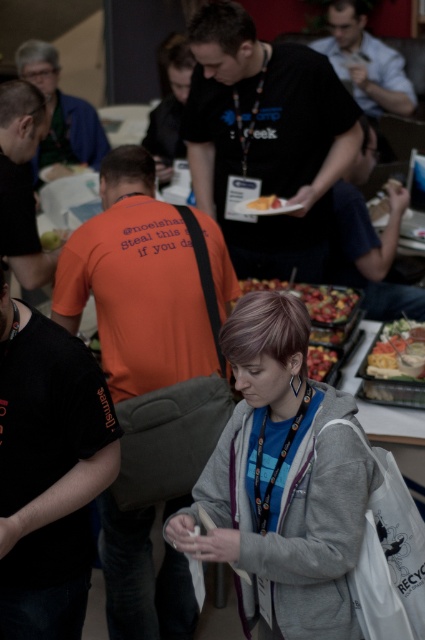
In the scene shown: Can you confirm if smooth plastic apples at center is positioned to the left of yellow matte cake at center?

Incorrect, smooth plastic apples at center is not on the left side of yellow matte cake at center.

In the scene shown: Does smooth plastic apples at center have a larger size compared to yellow matte cake at center?

Yes.

Does point (246, 291) lie behind point (251, 205)?

No, (246, 291) is in front of (251, 205).

This screenshot has width=425, height=640. Find the location of `smooth plastic apples at center`. smooth plastic apples at center is located at coordinates (317, 317).

Does white plastic tray at center appear over smooth plastic tray at center?

Yes.

How far apart are white plastic tray at center and smooth plastic tray at center?

A distance of 9.71 inches exists between white plastic tray at center and smooth plastic tray at center.

Which is in front, point (416, 324) or point (322, 369)?

Point (322, 369) is in front.

Locate an element on the screen. This screenshot has height=640, width=425. white plastic tray at center is located at coordinates (397, 349).

Does smooth plastic tray at center have a greater height compared to yellow matte cake at center?

Indeed, smooth plastic tray at center has a greater height compared to yellow matte cake at center.

Is smooth plastic tray at center to the right of yellow matte cake at center from the viewer's perspective?

Indeed, smooth plastic tray at center is positioned on the right side of yellow matte cake at center.

Who is more distant from viewer, [308,356] or [249,208]?

Point [249,208]

This screenshot has height=640, width=425. I want to click on smooth plastic tray at center, so click(x=320, y=362).